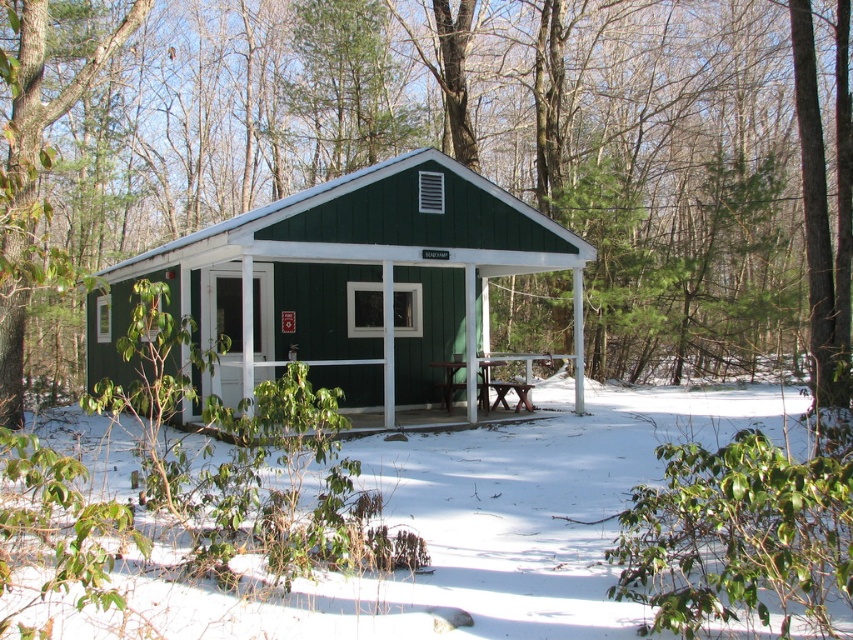
Question: Which is nearer to the brown wooden picnic table at lower center?

Choices:
 (A) green wood porch at center
 (B) green wood tree at center

Answer: (A)

Question: Is white powdery snow at lower center to the left of green wood porch at center from the viewer's perspective?

Choices:
 (A) no
 (B) yes

Answer: (A)

Question: Which of the following is the closest to the observer?

Choices:
 (A) green wood porch at center
 (B) green matte cabin at center

Answer: (B)

Question: Can you confirm if green matte cabin at center is wider than green wood porch at center?

Choices:
 (A) yes
 (B) no

Answer: (A)

Question: Can you confirm if white powdery snow at lower center is positioned below green wood porch at center?

Choices:
 (A) yes
 (B) no

Answer: (A)

Question: Which of the following is the farthest from the observer?

Choices:
 (A) green wood porch at center
 (B) green matte cabin at center

Answer: (A)